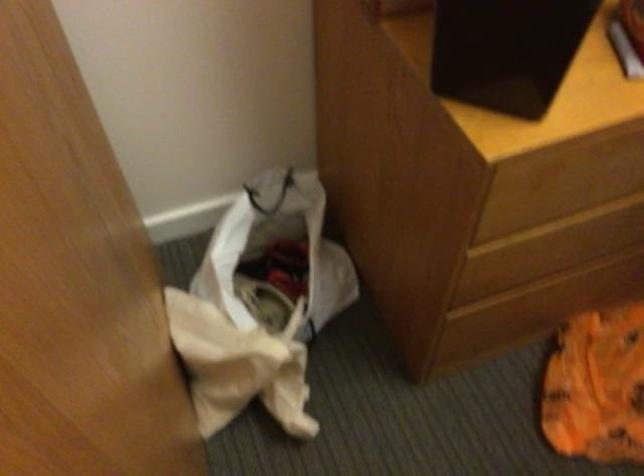
Based on the photo, based on the continuous images, in which direction is the camera rotating?

The camera rotated toward left-down.